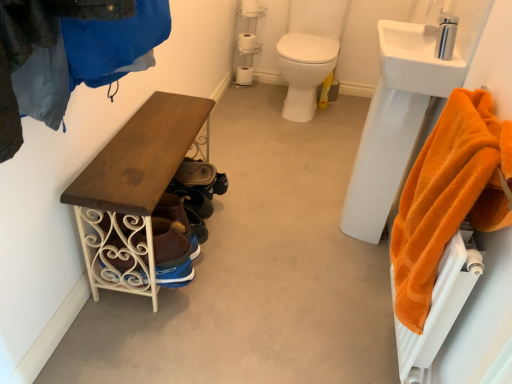
I want to click on vacant space in front of white glossy toilet at center, so click(292, 137).